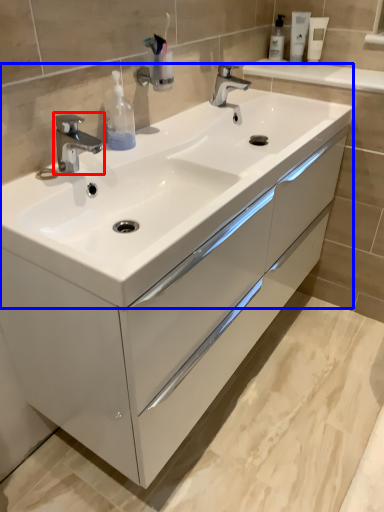
Question: Which point is closer to the camera, tap (highlighted by a red box) or sink (highlighted by a blue box)?

Choices:
 (A) tap
 (B) sink

Answer: (B)